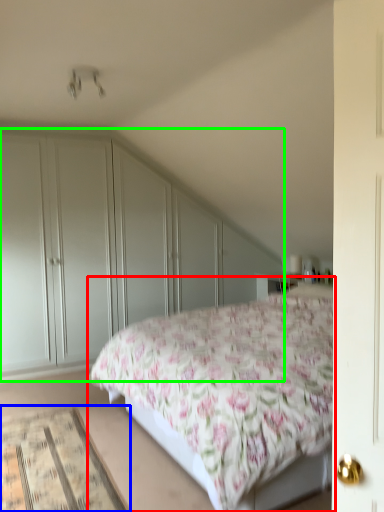
Question: Which object is positioned farthest from bed (highlighted by a red box)? Select from mat (highlighted by a blue box) and dresser (highlighted by a green box).

Choices:
 (A) mat
 (B) dresser

Answer: (B)